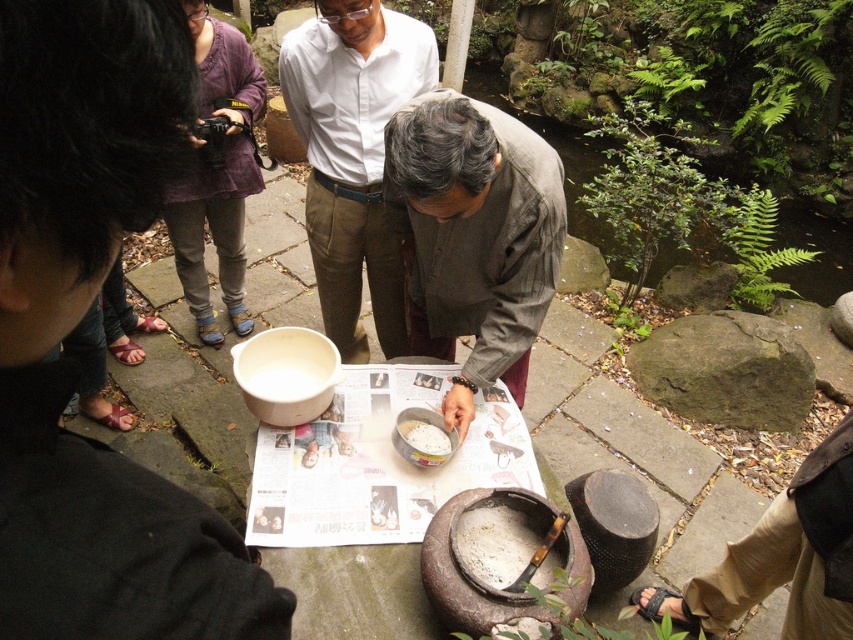
Question: Is purple cotton sweater at upper left wider than green leafy plant at upper right?

Choices:
 (A) yes
 (B) no

Answer: (A)

Question: Which point is farther from the camera taking this photo?

Choices:
 (A) pyautogui.click(x=178, y=268)
 (B) pyautogui.click(x=622, y=275)

Answer: (B)

Question: Is matte black jacket at lower left bigger than green leafy plant at upper right?

Choices:
 (A) yes
 (B) no

Answer: (B)

Question: Is matte black jacket at lower left closer to camera compared to gray woolen sweater at center?

Choices:
 (A) no
 (B) yes

Answer: (B)

Question: Which of the following is the farthest from the observer?

Choices:
 (A) matte black jacket at lower left
 (B) gray woolen sweater at center
 (C) light brown cotton shirt at center
 (D) green leafy plant at upper right

Answer: (D)

Question: Among these objects, which one is nearest to the camera?

Choices:
 (A) newspaper paper at center
 (B) green leafy plant at upper right
 (C) white matte bowl at center

Answer: (A)